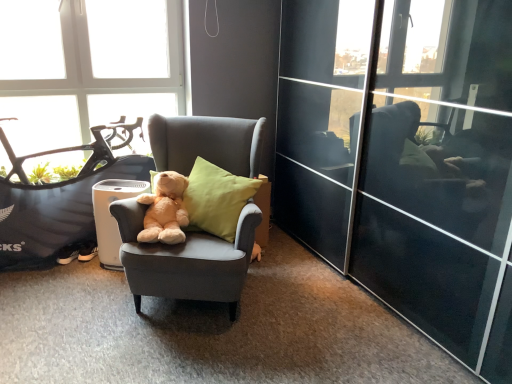
Locate an element on the screen. free location in front of black matte mountain bike at left is located at coordinates (71, 314).